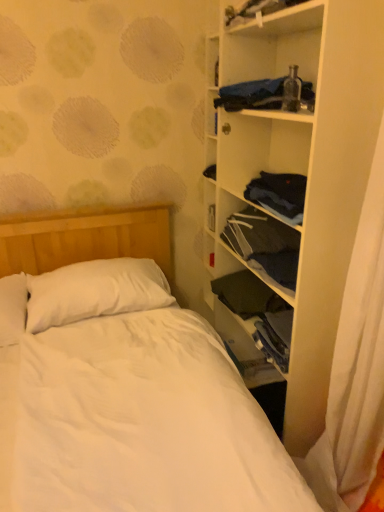
Question: Can you confirm if white matte shelf at right is bigger than dark blue fabric at center-right, which is counted as the 3th clothing, starting from the top?

Choices:
 (A) no
 (B) yes

Answer: (B)

Question: From the image's perspective, is white matte shelf at right over dark blue fabric at center-right, positioned as the first clothing in bottom-to-top order?

Choices:
 (A) yes
 (B) no

Answer: (A)

Question: From a real-world perspective, is white matte shelf at right on dark blue fabric at center-right, which is counted as the 3th clothing, starting from the top?

Choices:
 (A) yes
 (B) no

Answer: (A)

Question: Is white matte shelf at right outside of dark blue fabric at center-right, positioned as the first clothing in bottom-to-top order?

Choices:
 (A) no
 (B) yes

Answer: (B)

Question: Is white matte shelf at right beside dark blue fabric at center-right, which is counted as the 3th clothing, starting from the top?

Choices:
 (A) yes
 (B) no

Answer: (B)

Question: Is white matte shelf at right wider than dark blue fabric at center-right, positioned as the first clothing in bottom-to-top order?

Choices:
 (A) yes
 (B) no

Answer: (B)

Question: Is dark blue fabric at center-right, which is counted as the 3th clothing, starting from the top, shorter than white soft pillow at upper left?

Choices:
 (A) no
 (B) yes

Answer: (B)

Question: Can we say dark blue fabric at center-right, which is counted as the 3th clothing, starting from the top, lies outside white soft pillow at upper left?

Choices:
 (A) yes
 (B) no

Answer: (A)

Question: From the image's perspective, is dark blue fabric at center-right, positioned as the first clothing in bottom-to-top order, located above white soft pillow at upper left?

Choices:
 (A) yes
 (B) no

Answer: (B)

Question: Is the depth of dark blue fabric at center-right, which is counted as the 3th clothing, starting from the top, greater than that of white soft pillow at upper left?

Choices:
 (A) no
 (B) yes

Answer: (B)

Question: Is dark blue fabric at center-right, which is counted as the 3th clothing, starting from the top, oriented away from white soft pillow at upper left?

Choices:
 (A) yes
 (B) no

Answer: (B)

Question: Does dark blue fabric at center-right, which is counted as the 3th clothing, starting from the top, contain white soft pillow at upper left?

Choices:
 (A) no
 (B) yes

Answer: (A)

Question: From a real-world perspective, is blue fabric at upper right, which is counted as the third clothing, starting from the bottom, located beneath white matte shelf at right?

Choices:
 (A) yes
 (B) no

Answer: (B)